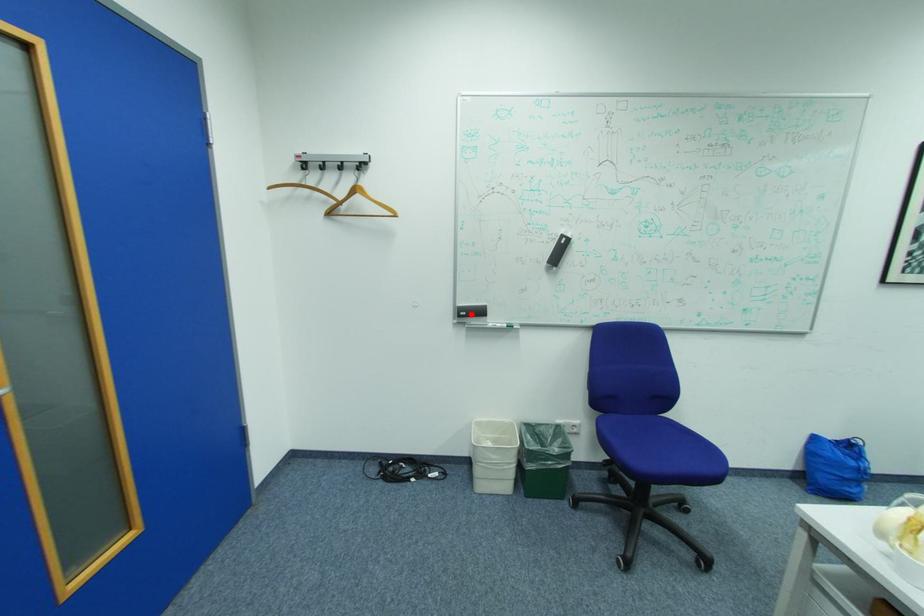
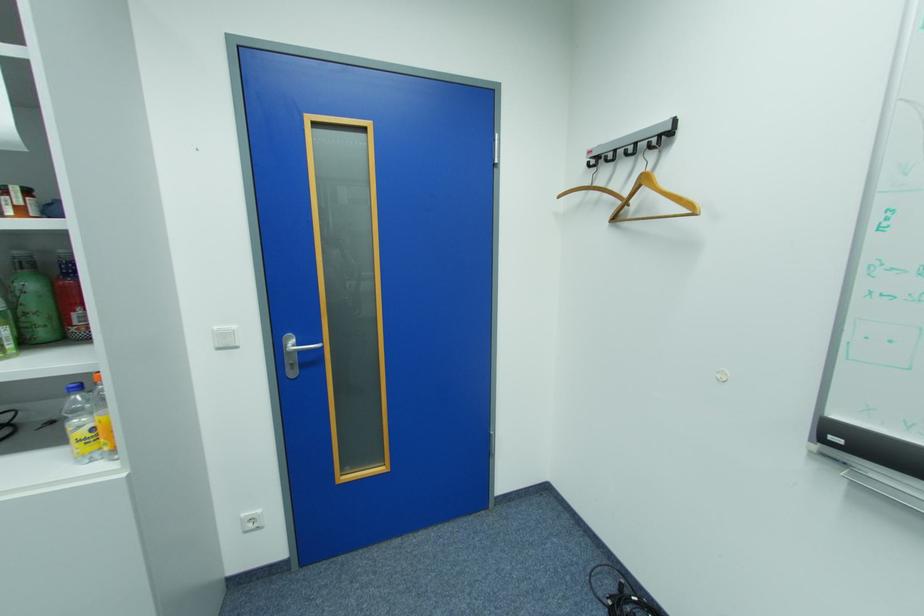
Question: I am providing you with two images of the same scene from different viewpoints. A red point is marked on the first image. At the location where the point appears in image 1, is it still visible in image 2?

Choices:
 (A) Yes
 (B) No

Answer: (A)